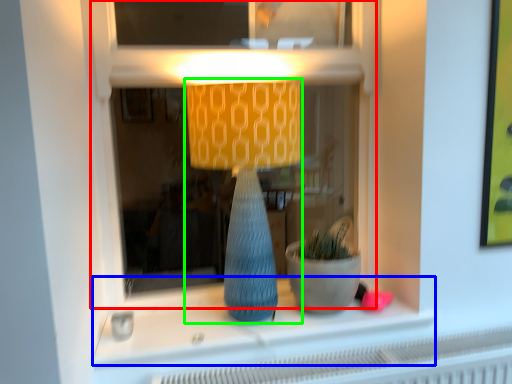
Question: Which object is positioned farthest from shop window (highlighted by a red box)? Select from window sill (highlighted by a blue box) and lamp (highlighted by a green box).

Choices:
 (A) window sill
 (B) lamp

Answer: (A)